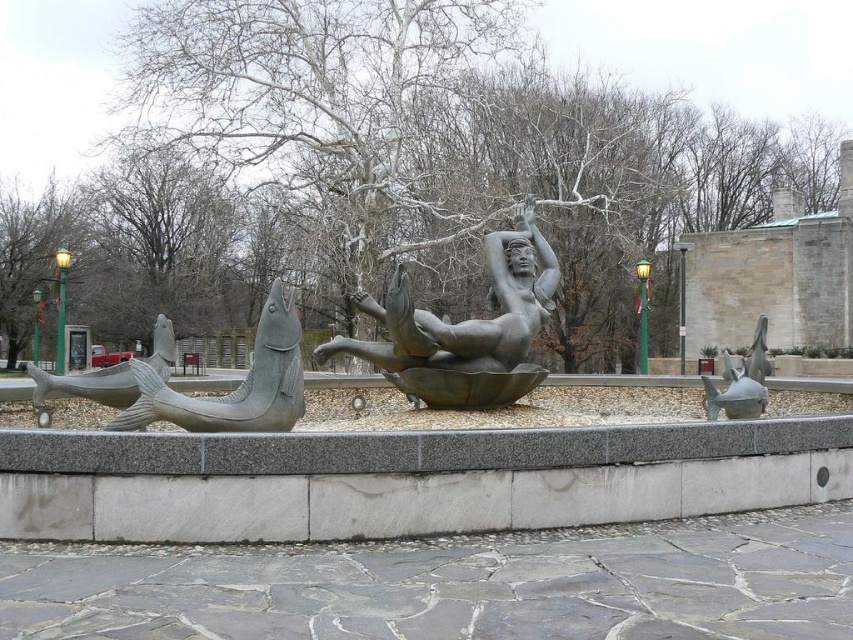
Question: Can you confirm if bronze statue at center is smaller than satin silver fish at right?

Choices:
 (A) yes
 (B) no

Answer: (A)

Question: Which point is farther to the camera?

Choices:
 (A) polished bronze fish at left
 (B) bronze statue at center

Answer: (B)

Question: Which is farther from the bronze statue at center?

Choices:
 (A) gray stone fish at left
 (B) satin silver fish at right

Answer: (B)

Question: Does polished bronze fish at left appear on the right side of gray stone fish at left?

Choices:
 (A) no
 (B) yes

Answer: (B)

Question: Which point is farther to the camera?

Choices:
 (A) bronze statue at center
 (B) satin silver fish at right
 (C) gray stone fish at left

Answer: (B)

Question: Does bronze statue at center appear on the right side of polished bronze fish at left?

Choices:
 (A) no
 (B) yes

Answer: (B)